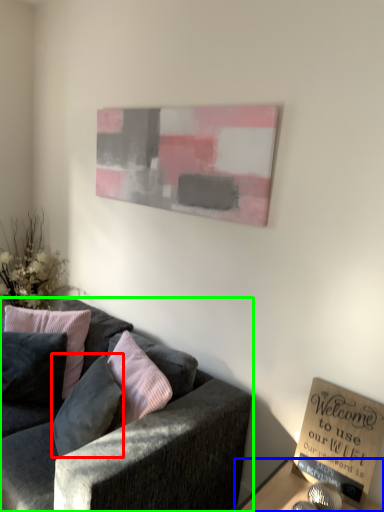
Question: Considering the real-world distances, which object is closest to pillow (highlighted by a red box)? table (highlighted by a blue box) or studio couch (highlighted by a green box).

Choices:
 (A) table
 (B) studio couch

Answer: (B)